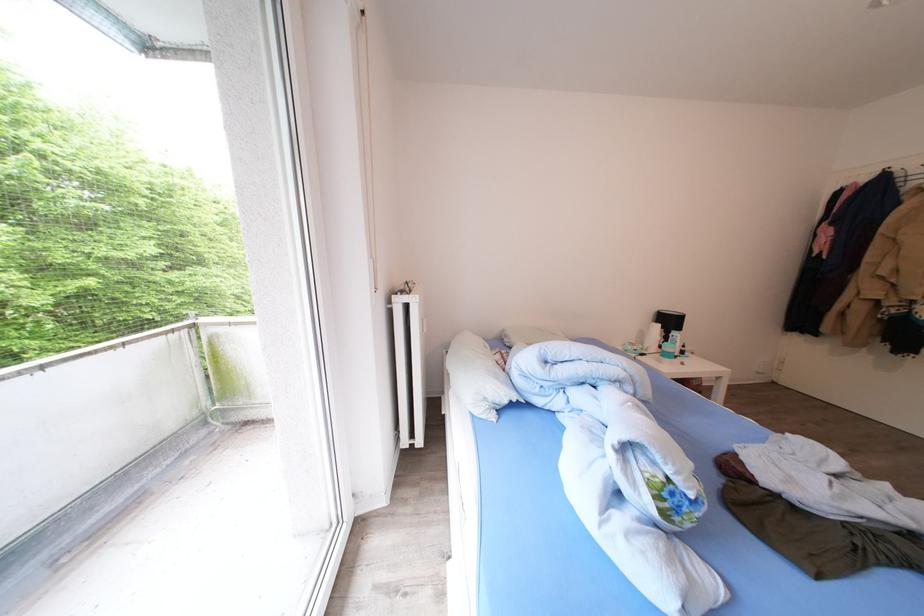
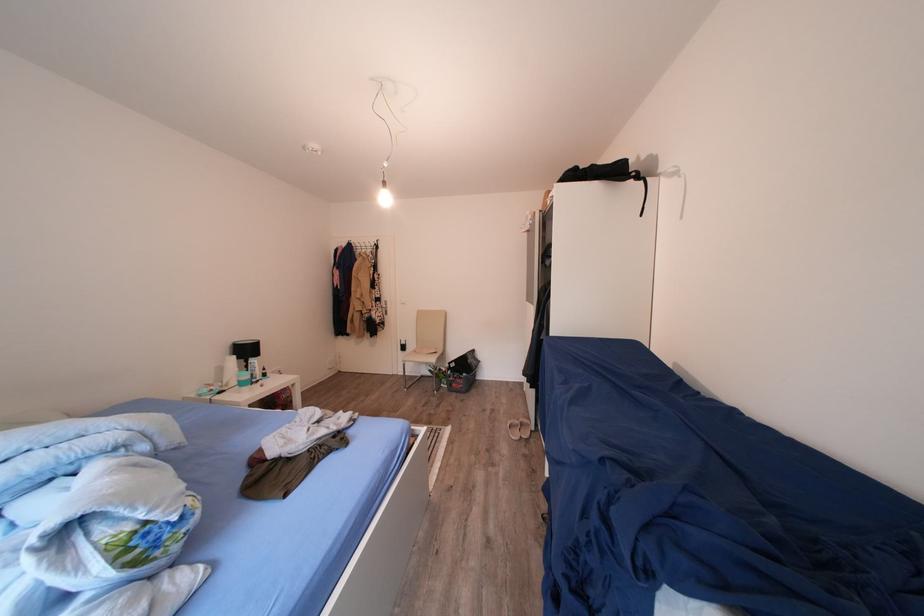
Question: The first image is from the beginning of the video and the second image is from the end. How did the camera likely rotate when shooting the video?

Choices:
 (A) Left
 (B) Right
 (C) Up
 (D) Down

Answer: (B)